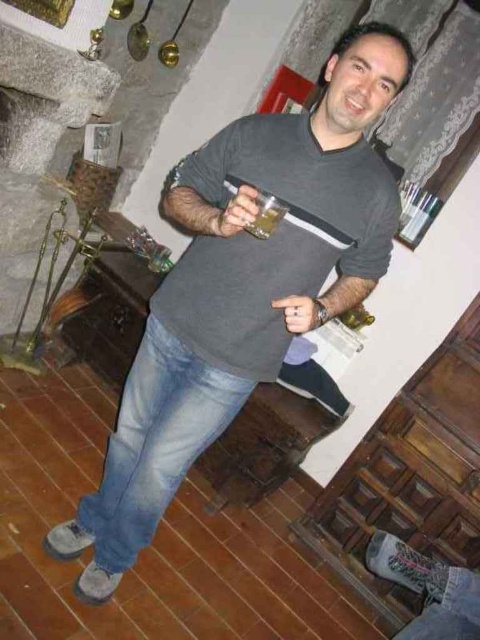
You are a bartender who needs to place a coaster between the matte plastic cup at center and the translucent glass at upper center. What is the minimum diameter the coaster must have to cover the space between them?

The matte plastic cup at center and the translucent glass at upper center are 1.72 inches apart, so the coaster must have a diameter of at least 1.72 inches to cover the space between them.